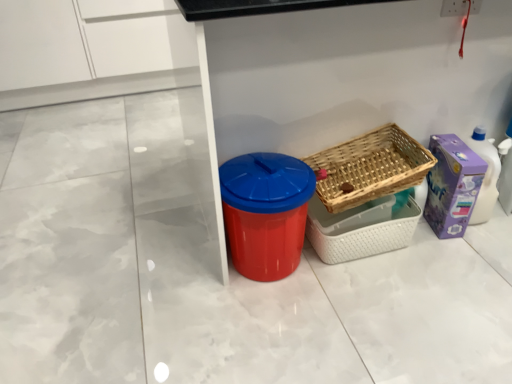
Question: Is purple cardboard box at right wider or thinner than woven wood basket at center right, marked as the second basket in a top-to-bottom arrangement?

Choices:
 (A) wide
 (B) thin

Answer: (A)

Question: Does point (440, 193) appear closer or farther from the camera than point (329, 253)?

Choices:
 (A) farther
 (B) closer

Answer: (A)

Question: Estimate the real-world distances between objects in this image. Which object is farther from the woven wood basket at center right, the first basket in the top-to-bottom sequence?

Choices:
 (A) purple cardboard box at right
 (B) woven wood basket at center right, marked as the second basket in a top-to-bottom arrangement
 (C) red plastic bin at center

Answer: (C)

Question: Which is nearer to the woven wood basket at center right, which appears as the first basket when ordered from the bottom?

Choices:
 (A) woven wood basket at center right, the first basket in the top-to-bottom sequence
 (B) red plastic bin at center
 (C) purple cardboard box at right

Answer: (A)